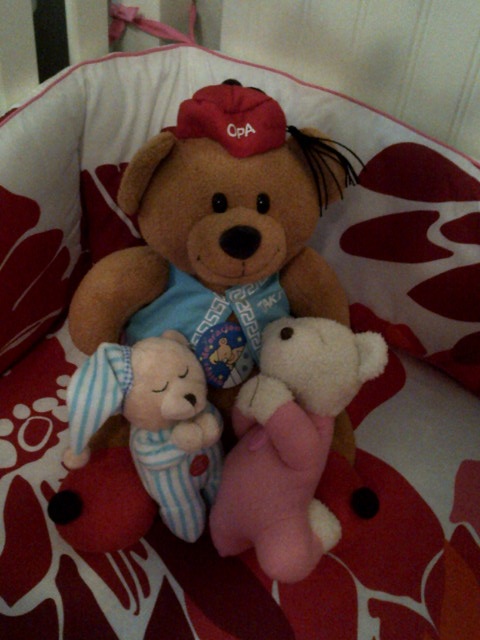
At what (x,y) coordinates should I click in order to perform the action: click on crib bars. Please return your answer as a coordinate pair (x, y). This screenshot has width=480, height=640. Looking at the image, I should click on (18, 29), (83, 12), (151, 10).